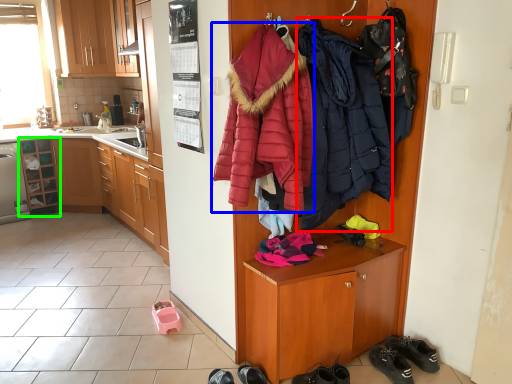
Question: Which object is positioned closest to jacket (highlighted by a red box)? Select from jacket (highlighted by a blue box) and cabinetry (highlighted by a green box).

Choices:
 (A) jacket
 (B) cabinetry

Answer: (A)